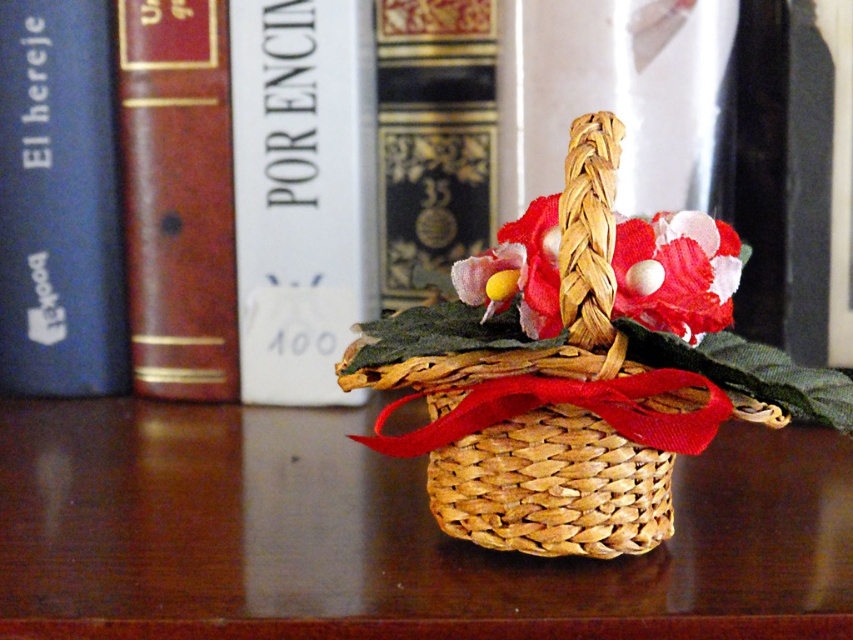
Question: Which point is farther to the camera?

Choices:
 (A) blue hardcover book at left
 (B) woven wood basket at center
 (C) brown leather book at left
 (D) white paper at upper center

Answer: (A)

Question: Which point is closer to the camera?

Choices:
 (A) (384, 214)
 (B) (189, 179)
 (C) (664, 321)
 (D) (242, 189)

Answer: (C)

Question: Observing the image, what is the correct spatial positioning of gold embossed book at center in reference to matte floral decoration at center?

Choices:
 (A) above
 (B) below

Answer: (A)

Question: Which of the following is the closest to the observer?

Choices:
 (A) (364, 436)
 (B) (35, 621)

Answer: (B)

Question: Can you confirm if woven straw basket at center is positioned above blue hardcover book at left?

Choices:
 (A) yes
 (B) no

Answer: (B)

Question: Can you confirm if woven straw basket at center is positioned above white paper at upper center?

Choices:
 (A) no
 (B) yes

Answer: (A)